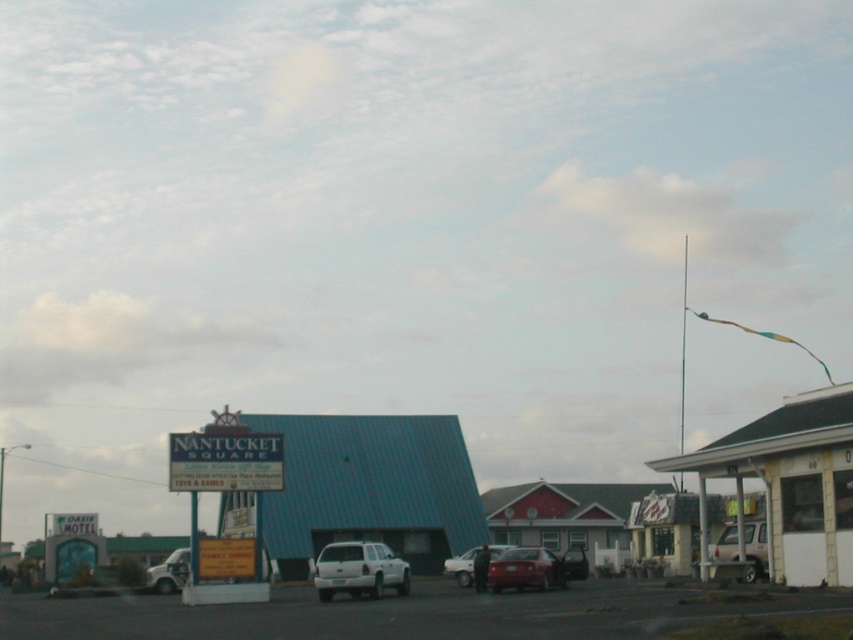
You are a delivery driver who needs to park your truck between the blue corrugated metal motel at center and the shiny red sedan at center. Is there enough space between them to fit your truck, which is 2.5 meters wide?

The blue corrugated metal motel at center is positioned on the left side of the shiny red sedan at center. Since the motel is to the left of the sedan, there is space between them. However, the exact width isn not specified, so it is uncertain if the 2.5 meter truck can fit without more information on the distance between the two objects.

You are standing at the roadside and want to take a photo of the blue corrugated metal motel at center. Your camera can focus on objects up to 150 feet away. Is the motel within your camera focus range?

The blue corrugated metal motel at center is 126.61 feet away from the viewer, which is within the camera focus range of up to 150 feet. Yes, the motel is within the focus range.

You are a tourist standing in front of the Nantucket Square building. You see the blue corrugated metal motel at center and the blue plastic sign at center. Which object is closer to you?

The blue corrugated metal motel at center is closer to you because it is in front of the blue plastic sign at center.